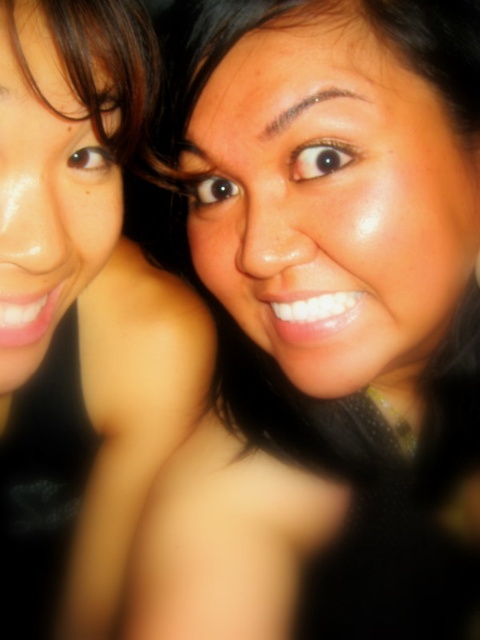
From the picture: You are a photographer adjusting the camera focus. The camera is currently focused at point 0.5, 0.7. Will the smooth skin face at upper right be in focus?

The smooth skin face at upper right is at point (323, 321), which is very close to the camera focus point (336, 320). Therefore, the smooth skin face at upper right will be in focus.

You are a photographer adjusting the lighting for a portrait. You notice two areas of skin tones in the image, the smooth skin face at upper right and the matte skin at upper center. Which skin area is closer to the camera?

The smooth skin face at upper right is closer to the camera than the matte skin at upper center because the matte skin at upper center is behind it.

You are taking a photo of two points in a scene. The first point is at coordinates point [283,595] and the second point is at point [110,541]. From the photographer perspective, which point is closer to you?

Point [283,595] is in front of point [110,541], so it is closer to the photographer.